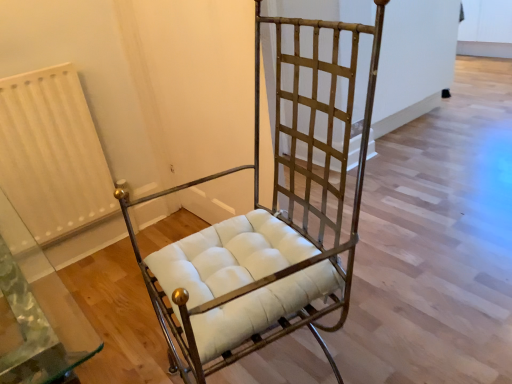
Question: From a real-world perspective, is white textured radiator at left positioned above or below gold metal chair at center?

Choices:
 (A) above
 (B) below

Answer: (B)

Question: Considering the relative positions of white textured radiator at left and gold metal chair at center in the image provided, is white textured radiator at left to the left or to the right of gold metal chair at center?

Choices:
 (A) left
 (B) right

Answer: (A)

Question: Considering the positions of white textured radiator at left and gold metal chair at center in the image, is white textured radiator at left bigger or smaller than gold metal chair at center?

Choices:
 (A) small
 (B) big

Answer: (A)

Question: Is gold metal chair at center in front of or behind white textured radiator at left in the image?

Choices:
 (A) front
 (B) behind

Answer: (A)

Question: Considering the relative positions of gold metal chair at center and white textured radiator at left in the image provided, is gold metal chair at center to the left or to the right of white textured radiator at left?

Choices:
 (A) right
 (B) left

Answer: (A)

Question: Looking at the image, does gold metal chair at center seem bigger or smaller compared to white textured radiator at left?

Choices:
 (A) small
 (B) big

Answer: (B)

Question: From a real-world perspective, is gold metal chair at center positioned above or below white textured radiator at left?

Choices:
 (A) below
 (B) above

Answer: (B)